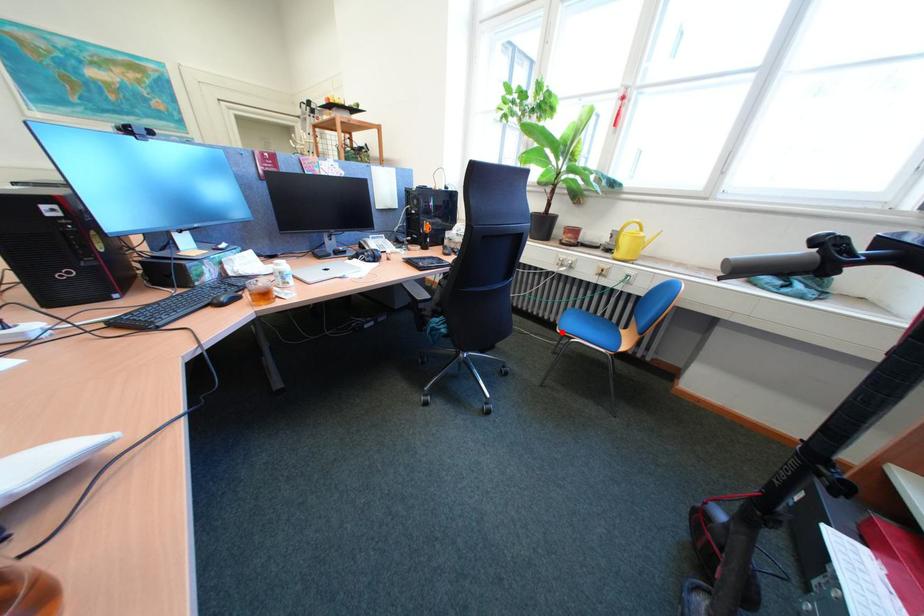
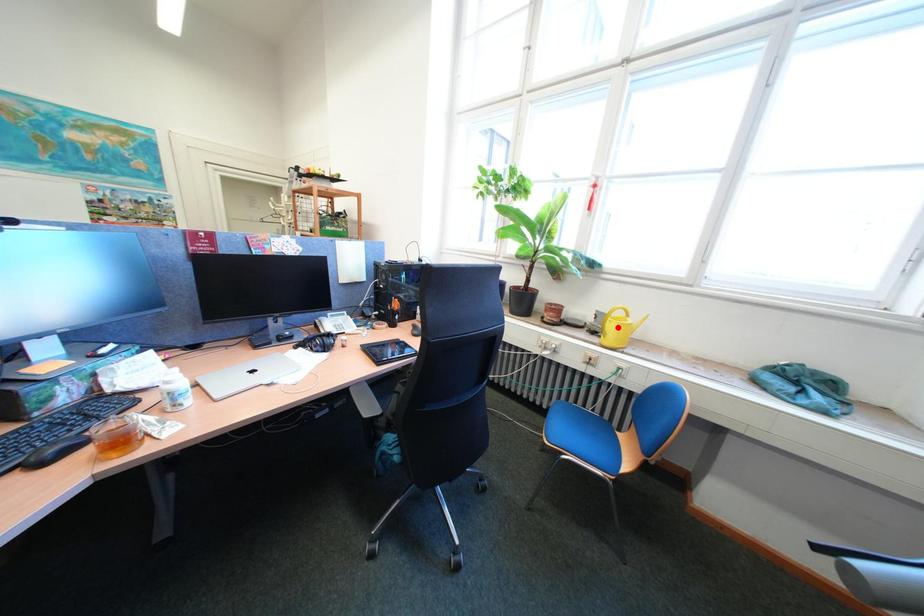
I am providing you with two images of the same scene from different viewpoints. A red point is marked on the first image and another point is marked on the second image. Is the marked point in image1 the same physical position as the marked point in image2?

No